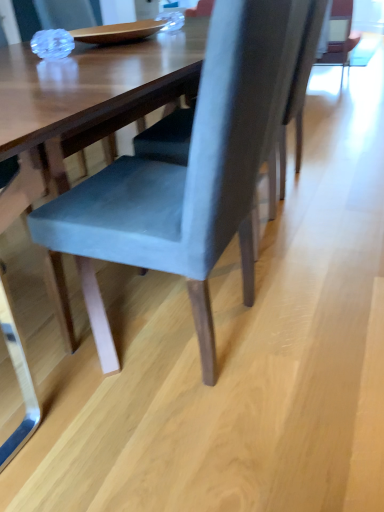
The height and width of the screenshot is (512, 384). I want to click on vacant area situated below velvet blue chair at center, placed as the 1th chair when sorted from front to back (from a real-world perspective), so click(171, 329).